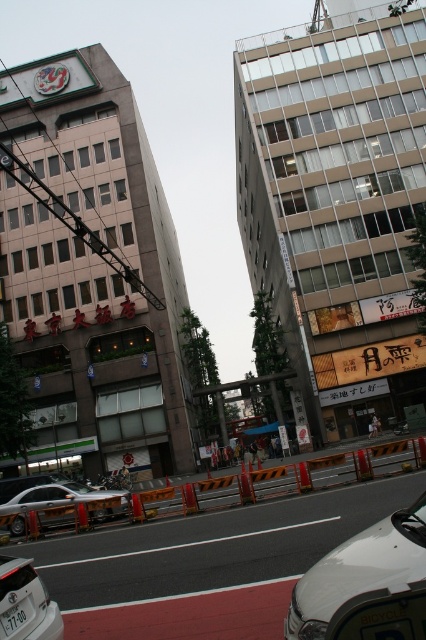
What do you see at coordinates (25, 602) in the screenshot?
I see `white matte car at lower left` at bounding box center [25, 602].

Is point (2, 584) closer to viewer compared to point (6, 634)?

No, it is not.

I want to click on white matte car at lower left, so click(x=25, y=602).

Does white glossy car at lower right have a larger size compared to white plastic license plate at lower left?

Yes, white glossy car at lower right is bigger than white plastic license plate at lower left.

Does point (313, 625) come farther from viewer compared to point (3, 628)?

That is False.

Does point (294, 630) come closer to viewer compared to point (8, 632)?

That is True.

Identify the location of white glossy car at lower right. (359, 570).

Between orange plastic barrier at center and silver metallic sedan at center, which one appears on the right side from the viewer's perspective?

orange plastic barrier at center

Does orange plastic barrier at center have a greater height compared to silver metallic sedan at center?

Correct, orange plastic barrier at center is much taller as silver metallic sedan at center.

This screenshot has height=640, width=426. What do you see at coordinates (281, 481) in the screenshot?
I see `orange plastic barrier at center` at bounding box center [281, 481].

Identify the location of orange plastic barrier at center. The width and height of the screenshot is (426, 640). (281, 481).